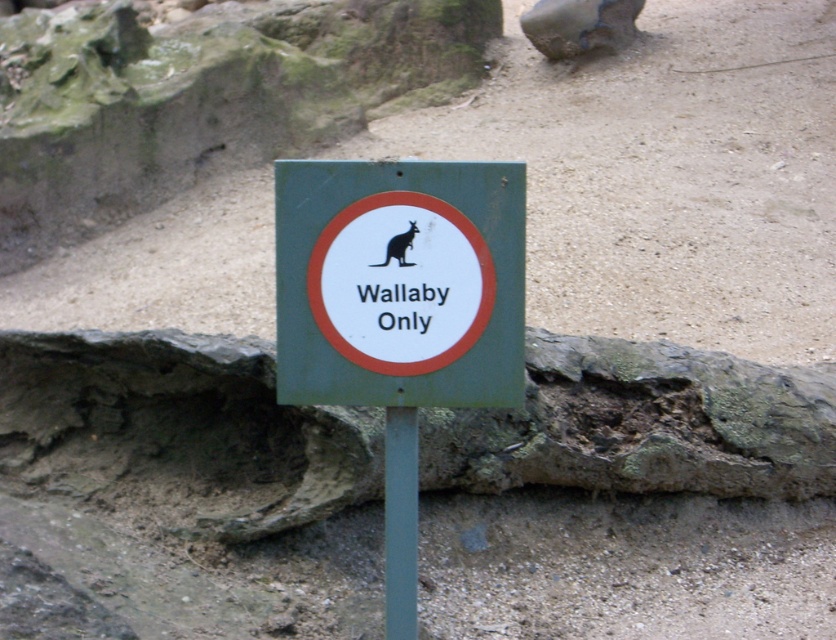
In the scene shown: You are a zookeeper standing at the camera position. You need to place a new feeding station exactly 3 meters away from the point marked at coordinates point (409, 499). Is this possible given the current setup?

The distance between point (409, 499) and the camera is 3.54 meters. Since the required distance for the feeding station is 3 meters, it is possible to place it within the allowed distance from the point.

You are a zookeeper who needs to place a new feeding station between the green matte sign at center and the brown fur wallaby at center. Since the sign is wider than the wallaby, which side of the path should the feeding station be placed to ensure it doesn

The green matte sign at center is wider than the brown fur wallaby at center. To place the feeding station between them appropriately, it should be positioned closer to the wallaby side since the sign takes up more space.